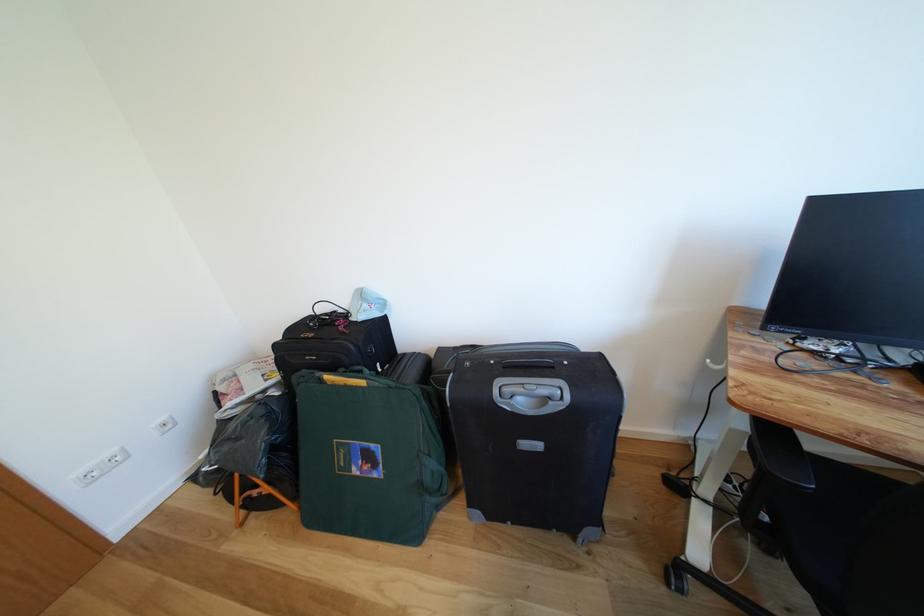
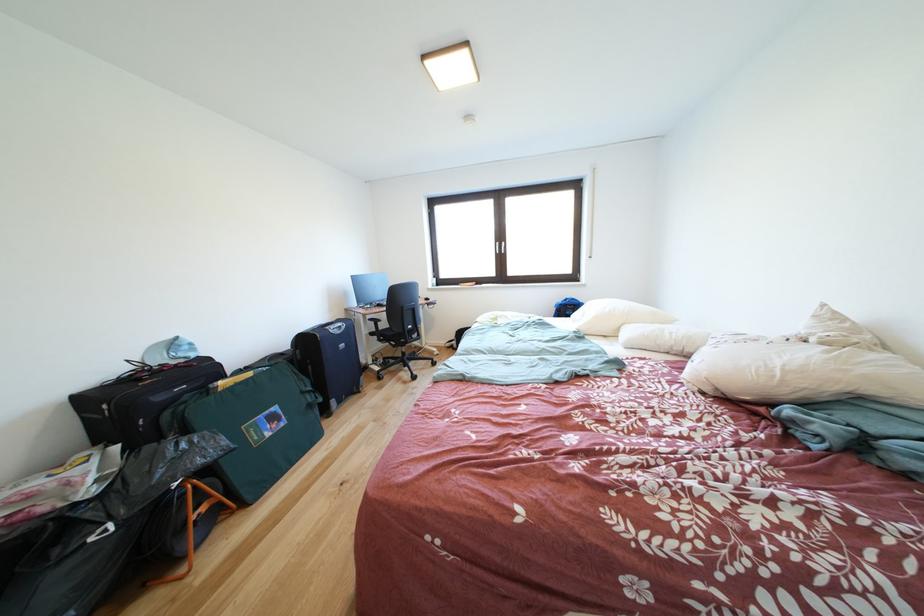
Where in the second image is the point corresponding to point (351, 338) from the first image?

(200, 371)